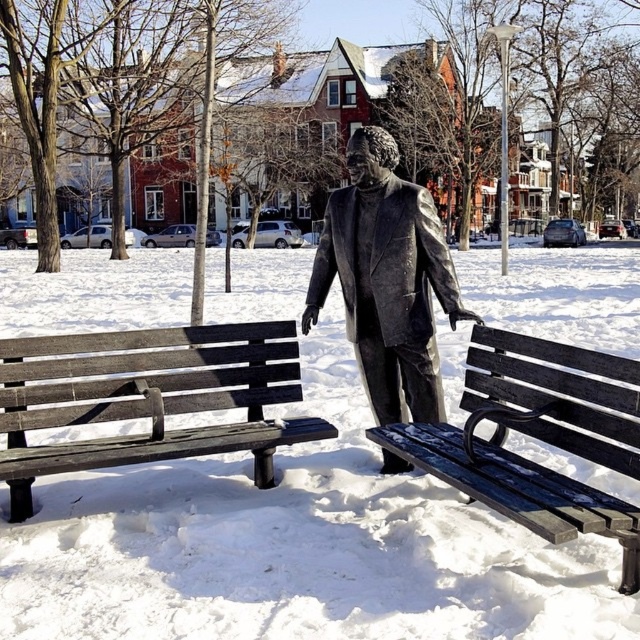
You are planning to place a small potted plant between the wooden bench at left and the dark wood bench at center. Which bench has a wider seat to accommodate the plant?

The wooden bench at left has a wider seat than the dark wood bench at center, so it can accommodate the plant better.

You are planning to place a small potted plant between the wooden bench at left and the dark wood bench at center. Which bench should the plant be closer to if you want it to be near the larger one?

The wooden bench at left is bigger than the dark wood bench at center, so the plant should be placed closer to the wooden bench at left.